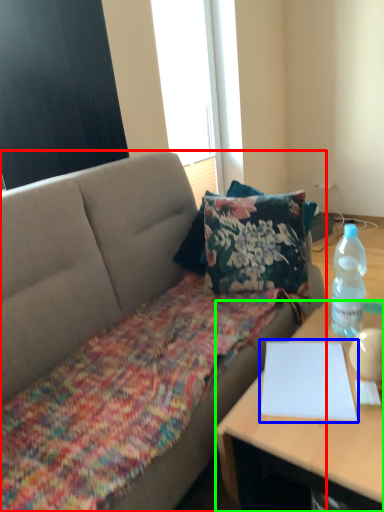
Question: Which object is positioned closest to studio couch (highlighted by a red box)? Select from notebook (highlighted by a blue box) and desk (highlighted by a green box).

Choices:
 (A) notebook
 (B) desk

Answer: (A)